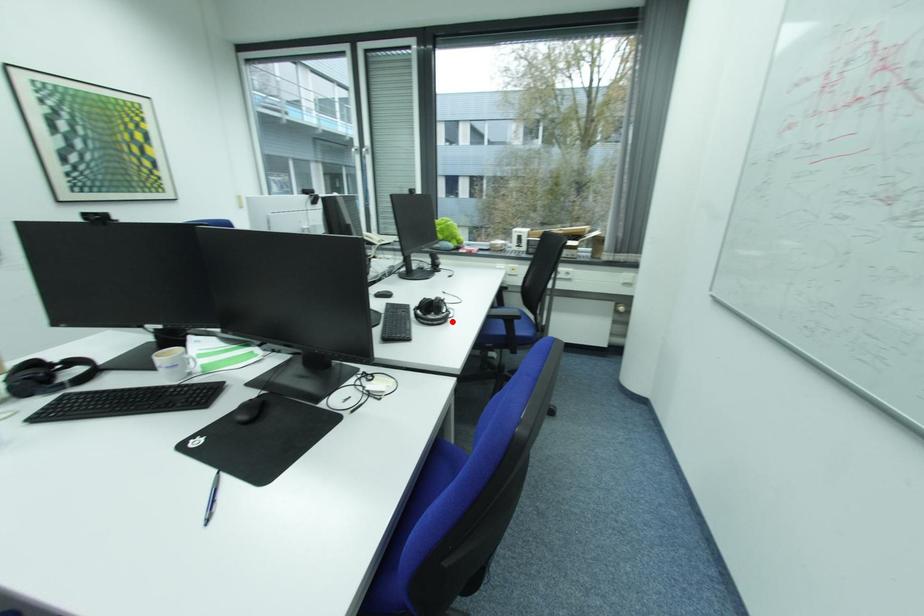
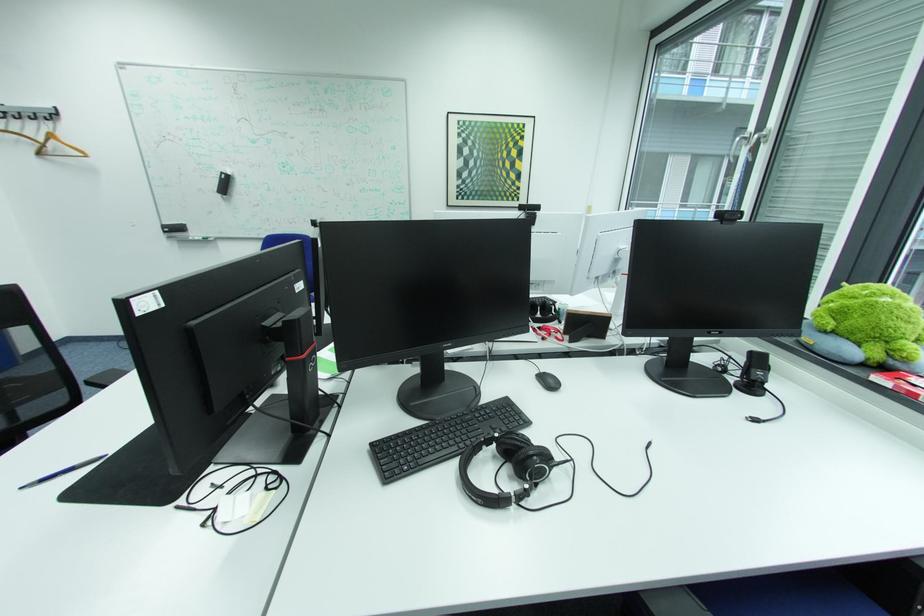
Find the pixel in the second image that matches the highlighted location in the first image.

(489, 501)